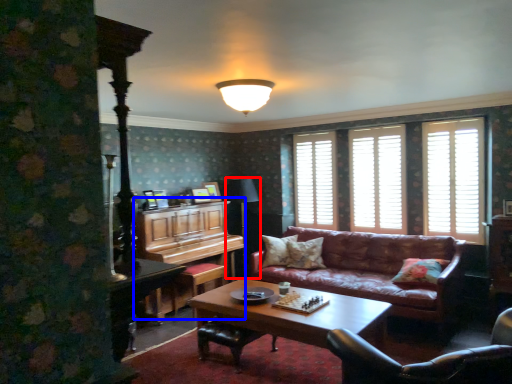
Question: Which of the following is the closest to the observer, table lamp (highlighted by a red box) or dresser (highlighted by a blue box)?

Choices:
 (A) table lamp
 (B) dresser

Answer: (B)